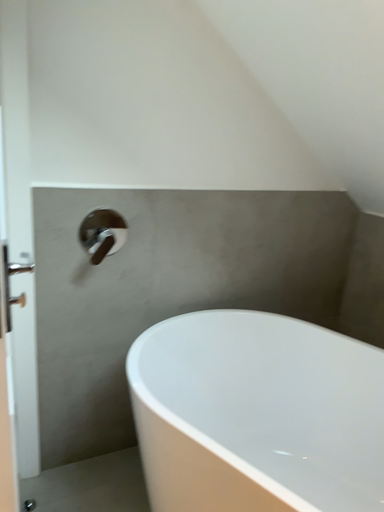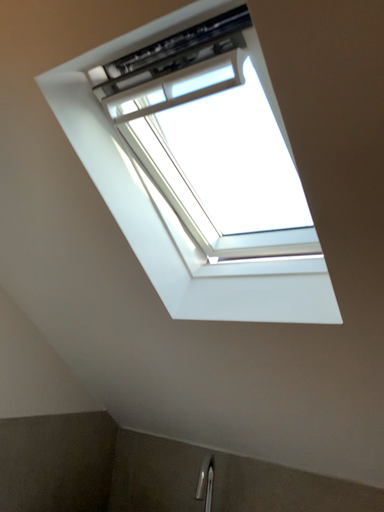
Question: Which way did the camera rotate in the video?

Choices:
 (A) rotated right
 (B) rotated left

Answer: (A)